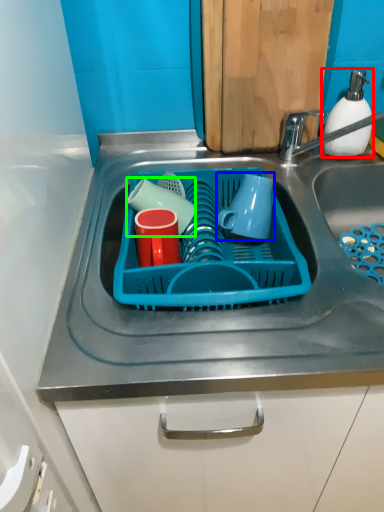
Question: Which object is positioned farthest from soap dispenser (highlighted by a red box)? Select from mug (highlighted by a blue box) and tableware (highlighted by a green box).

Choices:
 (A) mug
 (B) tableware

Answer: (B)